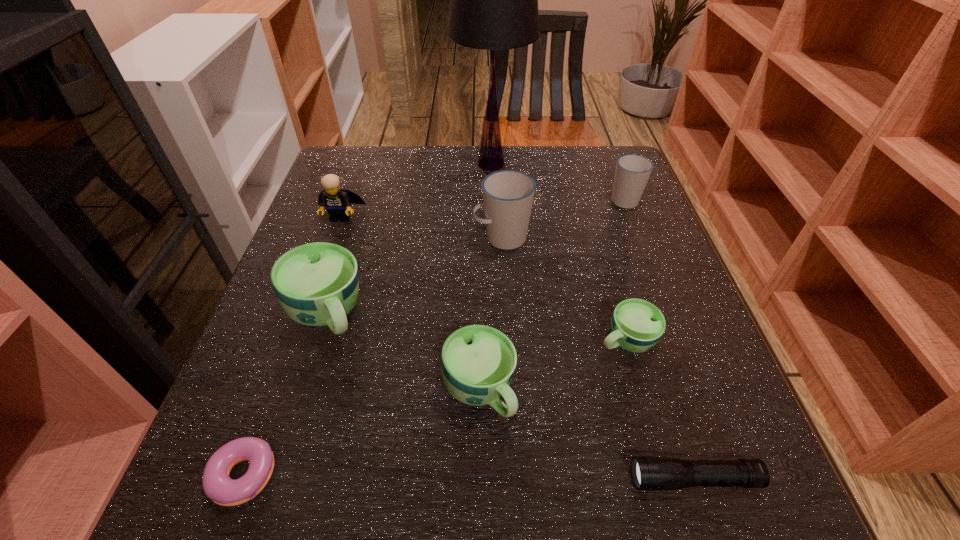
Image resolution: width=960 pixels, height=540 pixels. Find the location of `lampshade`. lampshade is located at coordinates (493, 0).

The image size is (960, 540). In order to click on the farthest object in this screenshot , I will do `click(493, 0)`.

Where is `the fourth nearest cup`? The height and width of the screenshot is (540, 960). the fourth nearest cup is located at coordinates (508, 195).

Where is `the eighth shortest object`? This screenshot has width=960, height=540. the eighth shortest object is located at coordinates (508, 195).

At what (x,y) coordinates should I click in order to perform the action: click on Lego. Please return your answer as a coordinate pair (x, y). This screenshot has height=540, width=960. Looking at the image, I should click on (338, 202).

You are a GUI agent. You are given a task and a screenshot of the screen. Output one action in this format:
    pyautogui.click(x=<x>, y=<y>)
    Task: Click on the leftmost blue cup
    Image resolution: width=960 pixels, height=540 pixels.
    Given the screenshot: What is the action you would take?
    pyautogui.click(x=317, y=284)

Where is `the leftmost cup`? This screenshot has height=540, width=960. the leftmost cup is located at coordinates (317, 284).

At what (x,y) coordinates should I click in order to perform the action: click on the smaller white cup. Please return your answer as a coordinate pair (x, y). This screenshot has height=540, width=960. Looking at the image, I should click on (632, 172).

Identify the location of the right white cup. This screenshot has width=960, height=540. (632, 172).

Locate an element on the screen. The width and height of the screenshot is (960, 540). the fourth tallest cup is located at coordinates (478, 362).